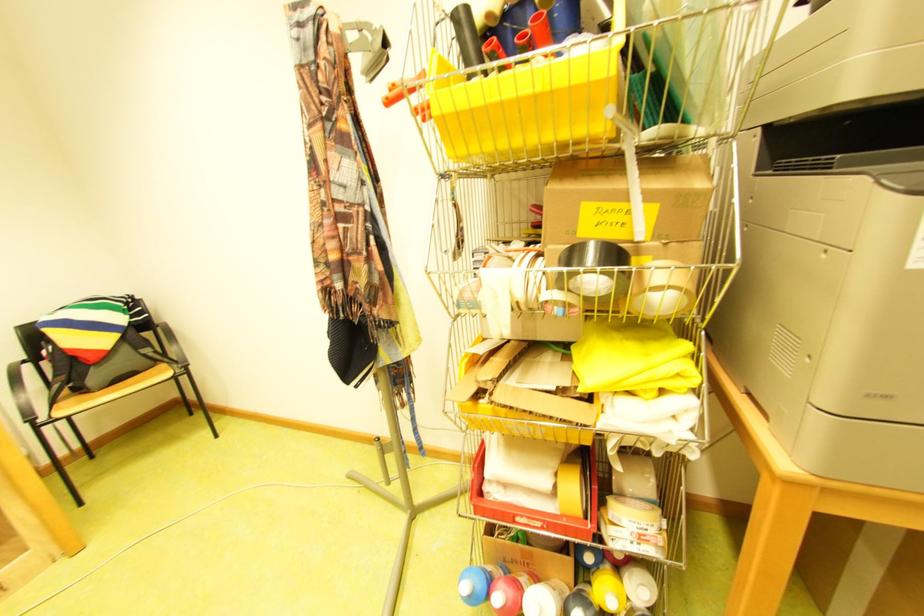
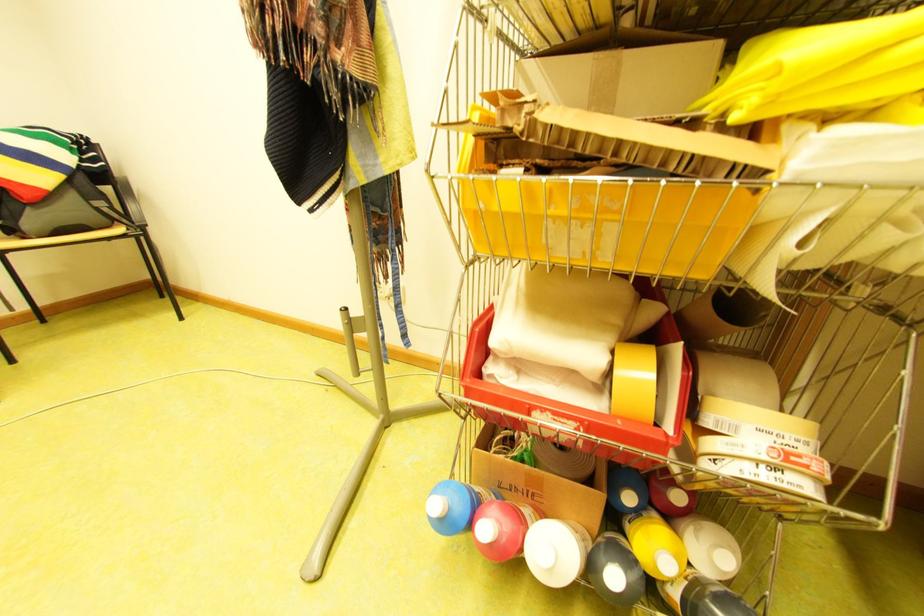
In the second image, find the point that corresponds to [541,519] in the first image.

(565, 414)